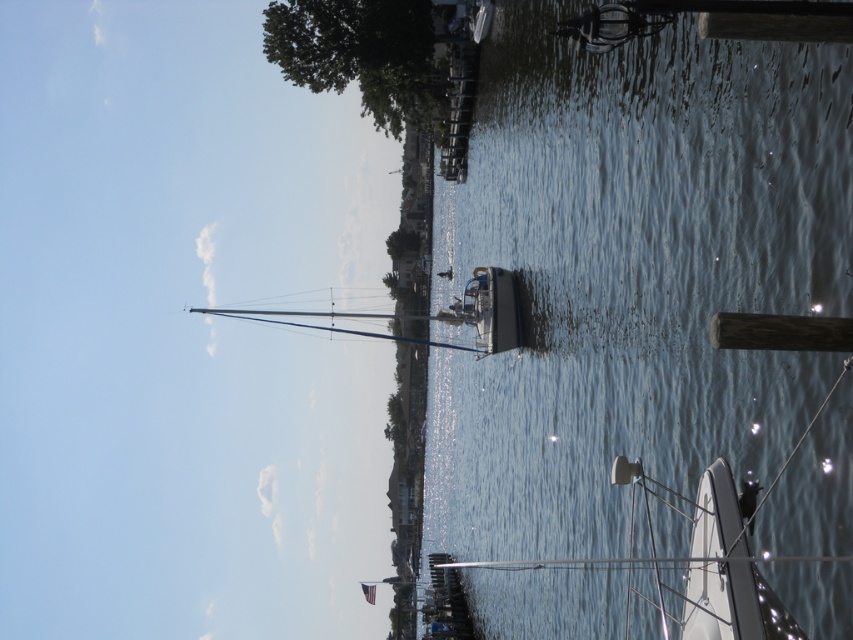
Question: Which object is the closest to the clear water at center?

Choices:
 (A) green leafy tree at upper left
 (B) white glossy sailboat at lower right

Answer: (A)

Question: Is clear water at center smaller than green leafy tree at upper left?

Choices:
 (A) no
 (B) yes

Answer: (A)

Question: Estimate the real-world distances between objects in this image. Which object is closer to the white glossy sailboat at lower right?

Choices:
 (A) clear water at center
 (B) green leafy tree at upper left

Answer: (A)

Question: Does white glossy sailboat at lower right have a larger size compared to green leafy tree at upper left?

Choices:
 (A) no
 (B) yes

Answer: (A)

Question: Which of the following is the closest to the observer?

Choices:
 (A) white glossy sailboat at lower right
 (B) green leafy tree at upper left

Answer: (A)

Question: Is clear water at center above white glossy sailboat at lower right?

Choices:
 (A) no
 (B) yes

Answer: (B)